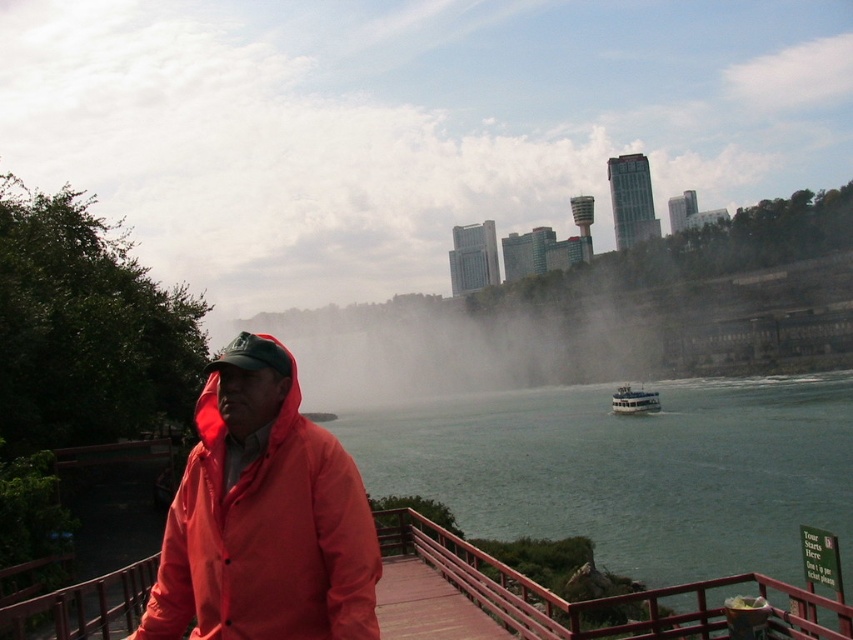
Is green water at center further to the viewer compared to white glossy boat at lower center?

No, it is not.

Is green water at center wider than white glossy boat at lower center?

Indeed, green water at center has a greater width compared to white glossy boat at lower center.

Find the location of a particular element. This screenshot has height=640, width=853. green water at center is located at coordinates (633, 468).

From the picture: Does green water at center come behind matte red jacket at center?

Yes, green water at center is further from the viewer.

Which of these two, green water at center or matte red jacket at center, stands taller?

green water at center is taller.

Find the location of a particular element. This screenshot has height=640, width=853. green water at center is located at coordinates (633, 468).

Where is `matte red jacket at center`? The height and width of the screenshot is (640, 853). matte red jacket at center is located at coordinates (264, 518).

Find the location of a particular element. Image resolution: width=853 pixels, height=640 pixels. matte red jacket at center is located at coordinates (264, 518).

This screenshot has width=853, height=640. What are the coordinates of `matte red jacket at center` in the screenshot? It's located at (264, 518).